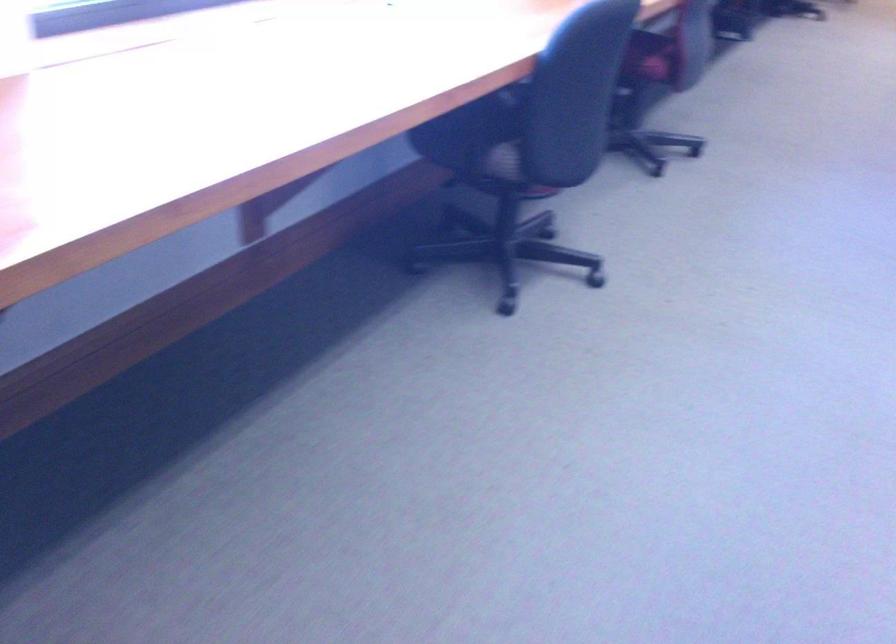
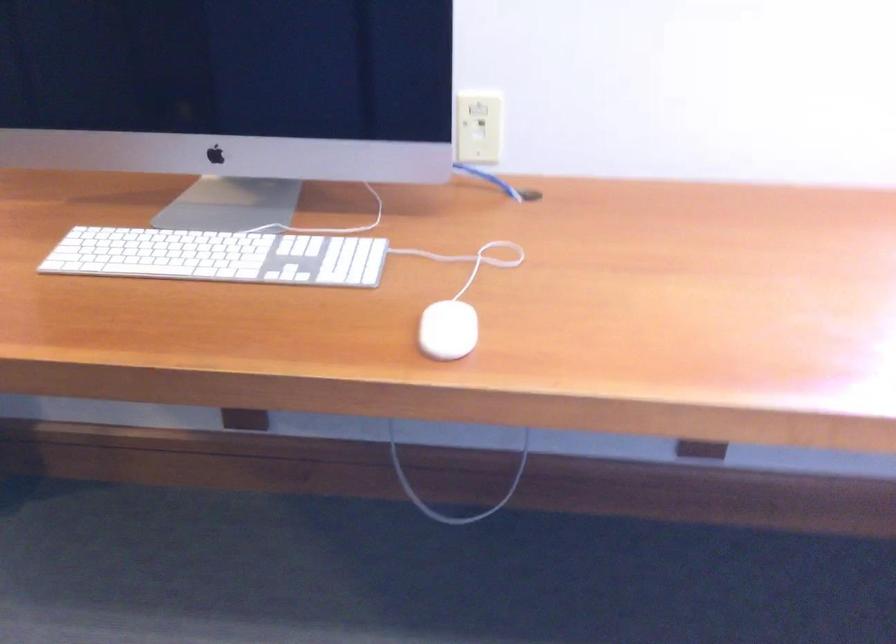
Question: How did the camera likely rotate?

Choices:
 (A) Left
 (B) Right
 (C) Up
 (D) Down

Answer: (A)